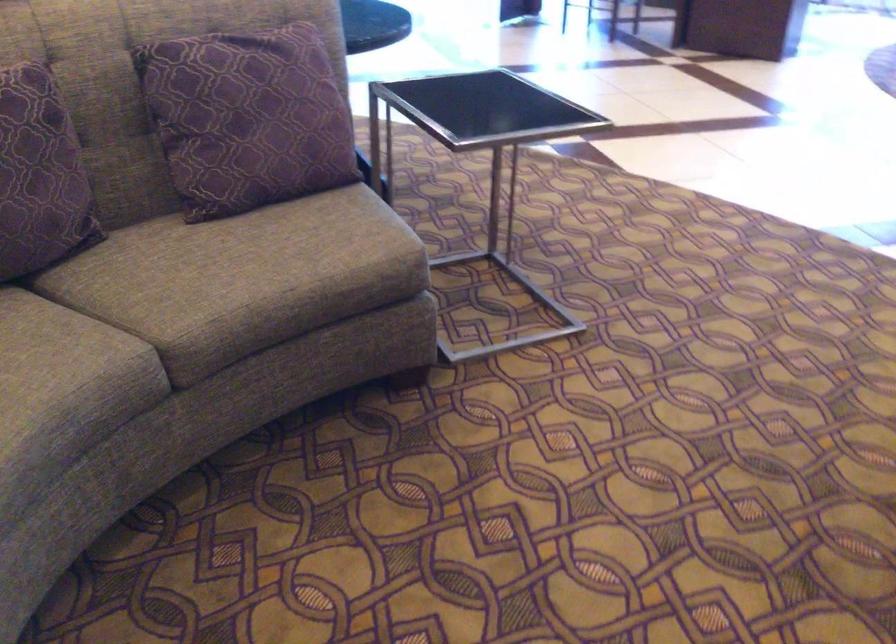
This screenshot has height=644, width=896. What do you see at coordinates (247, 277) in the screenshot?
I see `the sofa sitting surface` at bounding box center [247, 277].